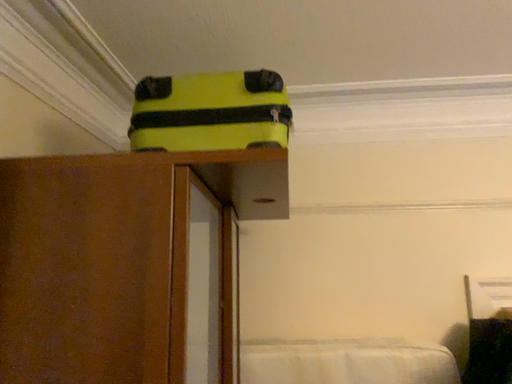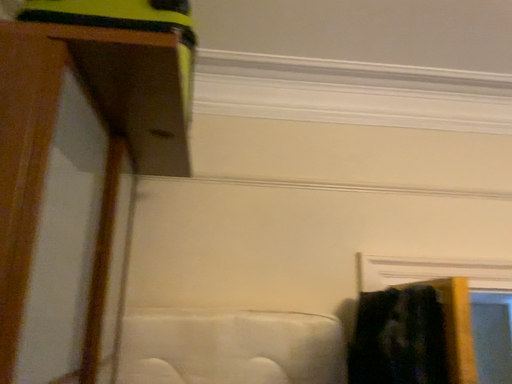
Question: Which way did the camera rotate in the video?

Choices:
 (A) rotated right
 (B) rotated left

Answer: (A)